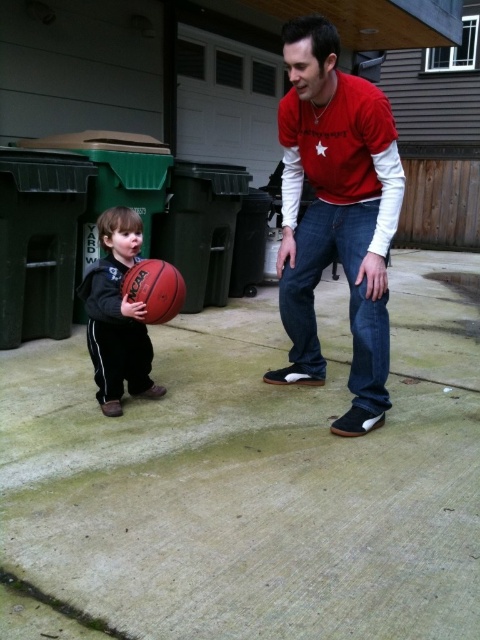
You are a photographer trying to capture a photo of both the rubber basketball at left and the rubber basketball at center. Based on their sizes in the image, which basketball should you focus on first to ensure it appears larger in the final photo?

The rubber basketball at left is taller than the rubber basketball at center, so you should focus on the rubber basketball at left first to ensure it appears larger in the final photo.

You are a photographer trying to capture a photo of the red cotton shirt at center and the rubber basketball at left. If you want to ensure both objects are fully visible in the frame, which object should you position closer to the camera?

The red cotton shirt at center might be wider than the rubber basketball at left, so positioning the red cotton shirt at center closer to the camera would ensure it fits within the frame while still capturing the rubber basketball at left.